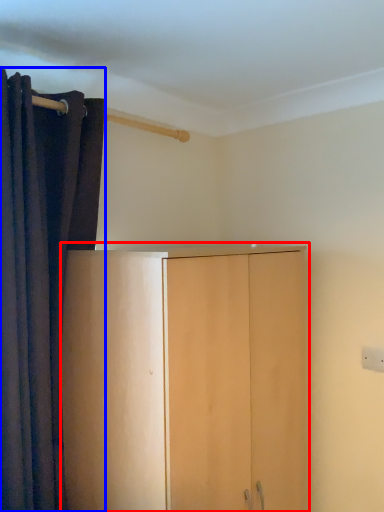
Question: Which point is closer to the camera, cupboard (highlighted by a red box) or curtain (highlighted by a blue box)?

Choices:
 (A) cupboard
 (B) curtain

Answer: (A)